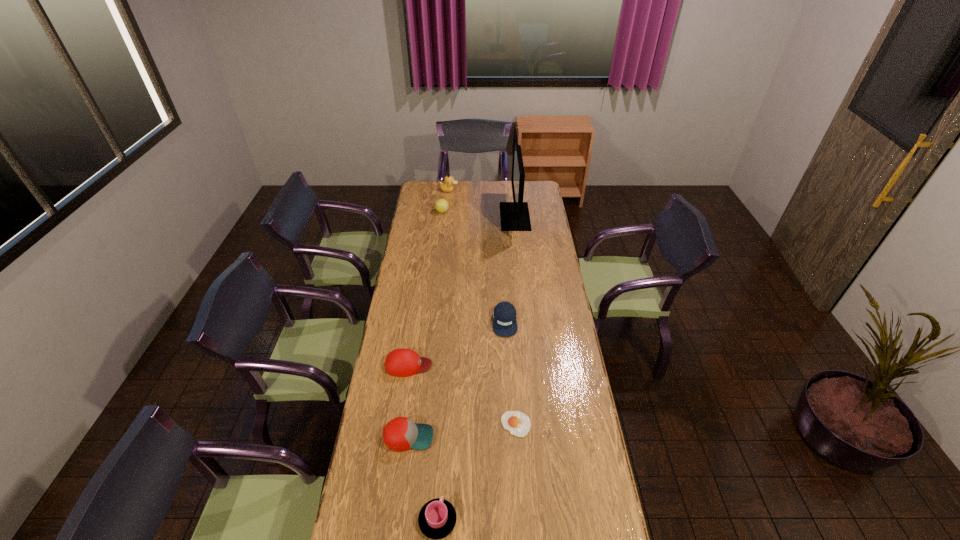
Select which baseball cap is the second closest to the tallest object. Please provide its 2D coordinates. Your answer should be formatted as a tuple, i.e. [(x, y)], where the tuple contains the x and y coordinates of a point satisfying the conditions above.

[(402, 362)]

Locate an element on the screen. vacant space that satisfies the following two spatial constraints: 1. on the back side of the egg yolk; 2. on the front-facing side of the fourth nearest object is located at coordinates (512, 365).

This screenshot has width=960, height=540. Identify the location of vacant space that satisfies the following two spatial constraints: 1. on the front side of the tennis ball; 2. on the front-facing side of the fifth farthest object. (425, 365).

Image resolution: width=960 pixels, height=540 pixels. I want to click on free spot that satisfies the following two spatial constraints: 1. on the front-facing side of the fifth farthest object; 2. on the left side of the egg yolk, so click(400, 424).

Locate an element on the screen. This screenshot has height=540, width=960. free point that satisfies the following two spatial constraints: 1. on the front side of the shortest object; 2. at the brim of the nearest baseball cap is located at coordinates 516,437.